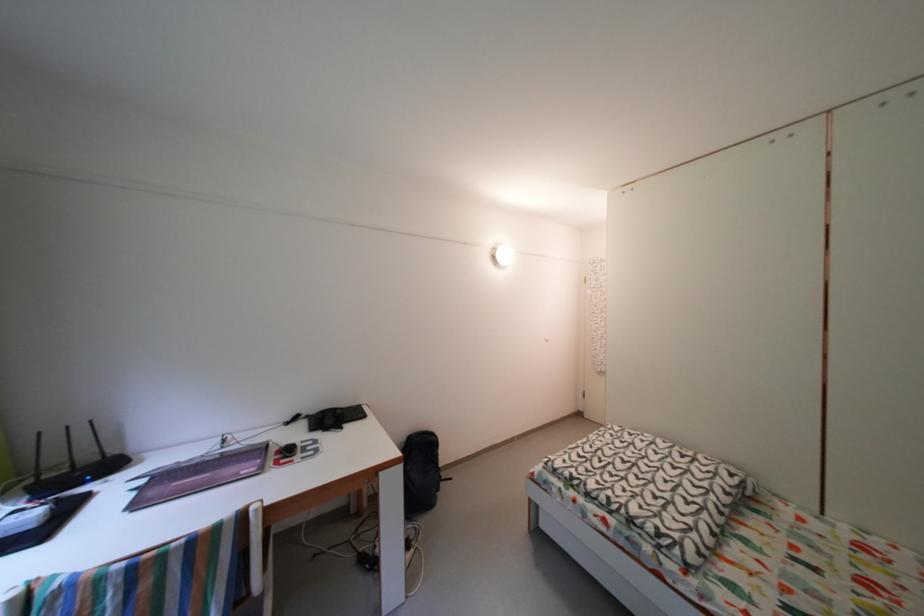
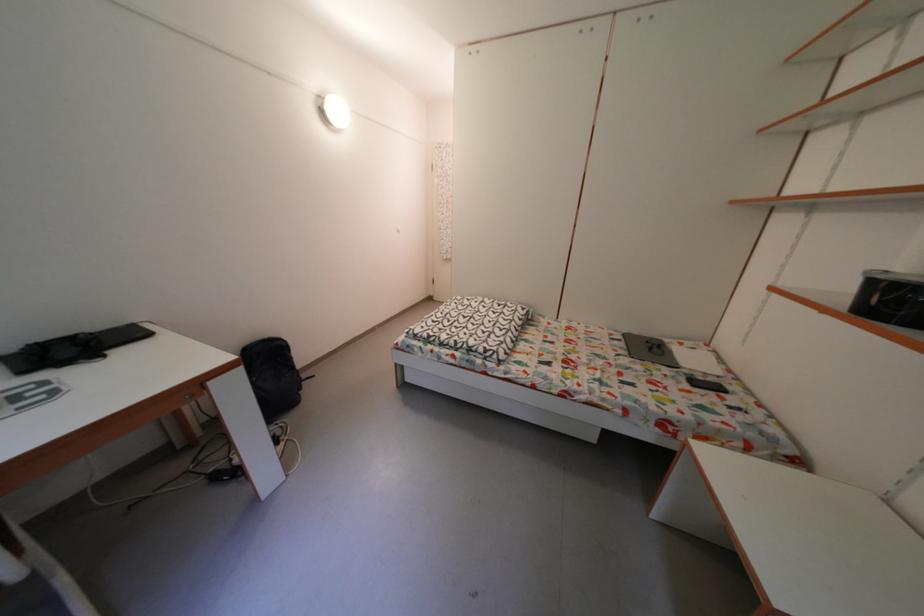
Where in the second image is the point corresponding to point (409, 474) from the first image?

(250, 376)